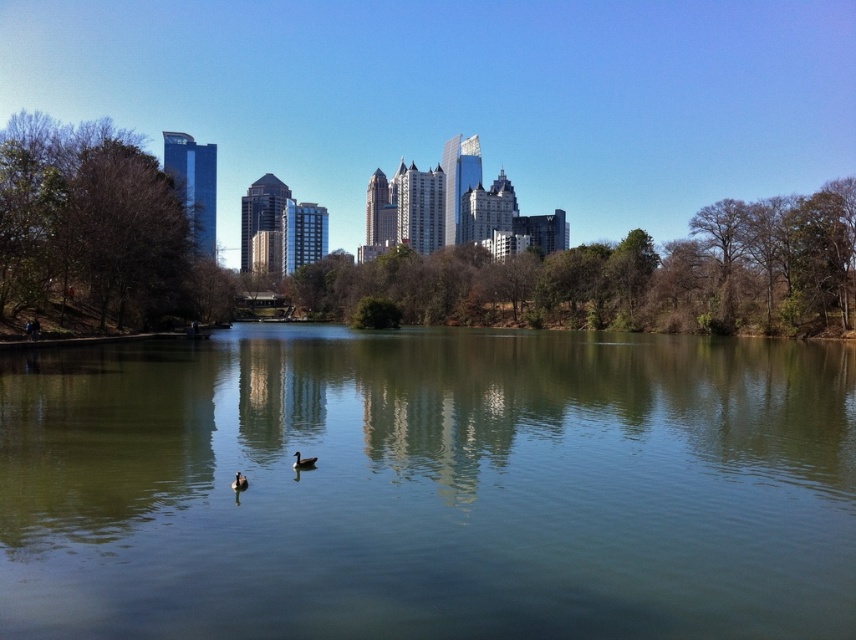
Question: Which of these objects is positioned farthest from the brown matte duck at lower center?

Choices:
 (A) green smooth water at center
 (B) brown matte duck at center

Answer: (A)

Question: Is green smooth water at center smaller than brown matte duck at lower center?

Choices:
 (A) no
 (B) yes

Answer: (A)

Question: Can you confirm if green smooth water at center is positioned to the left of brown matte duck at center?

Choices:
 (A) no
 (B) yes

Answer: (A)

Question: Is green smooth water at center to the left of brown matte duck at lower center from the viewer's perspective?

Choices:
 (A) no
 (B) yes

Answer: (A)

Question: Estimate the real-world distances between objects in this image. Which object is closer to the brown matte duck at center?

Choices:
 (A) green smooth water at center
 (B) brown matte duck at lower center

Answer: (B)

Question: Among these points, which one is farthest from the camera?

Choices:
 (A) (311, 458)
 (B) (236, 484)
 (C) (268, 614)

Answer: (A)